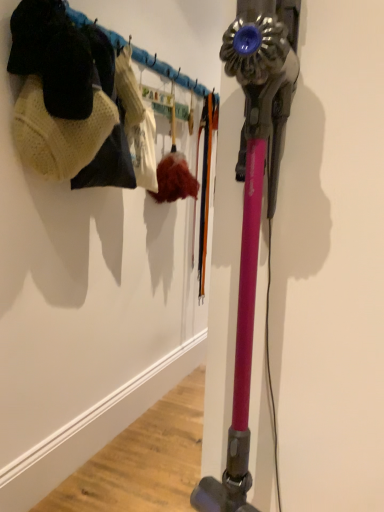
Question: From the image's perspective, is knitted wool hat at upper left on top of pink metallic vacuum at right?

Choices:
 (A) no
 (B) yes

Answer: (B)

Question: From a real-world perspective, does knitted wool hat at upper left sit lower than pink metallic vacuum at right?

Choices:
 (A) yes
 (B) no

Answer: (B)

Question: Can you confirm if knitted wool hat at upper left is positioned to the right of pink metallic vacuum at right?

Choices:
 (A) no
 (B) yes

Answer: (A)

Question: Could you tell me if knitted wool hat at upper left is turned towards pink metallic vacuum at right?

Choices:
 (A) yes
 (B) no

Answer: (B)

Question: Considering the relative sizes of knitted wool hat at upper left and pink metallic vacuum at right in the image provided, is knitted wool hat at upper left wider than pink metallic vacuum at right?

Choices:
 (A) no
 (B) yes

Answer: (B)

Question: Is pink metallic vacuum at right a part of knitted wool hat at upper left?

Choices:
 (A) no
 (B) yes

Answer: (A)

Question: Considering the relative sizes of pink metallic vacuum at right and knitted wool hat at upper left in the image provided, is pink metallic vacuum at right thinner than knitted wool hat at upper left?

Choices:
 (A) yes
 (B) no

Answer: (A)

Question: From a real-world perspective, is pink metallic vacuum at right located beneath knitted wool hat at upper left?

Choices:
 (A) yes
 (B) no

Answer: (A)

Question: Is pink metallic vacuum at right not near knitted wool hat at upper left?

Choices:
 (A) no
 (B) yes

Answer: (A)

Question: Would you say knitted wool hat at upper left is part of pink metallic vacuum at right's contents?

Choices:
 (A) no
 (B) yes

Answer: (A)

Question: Can you confirm if pink metallic vacuum at right is shorter than knitted wool hat at upper left?

Choices:
 (A) yes
 (B) no

Answer: (B)

Question: Can you confirm if pink metallic vacuum at right is wider than knitted wool hat at upper left?

Choices:
 (A) no
 (B) yes

Answer: (A)

Question: Is knitted wool hat at upper left bigger or smaller than pink metallic vacuum at right?

Choices:
 (A) small
 (B) big

Answer: (A)